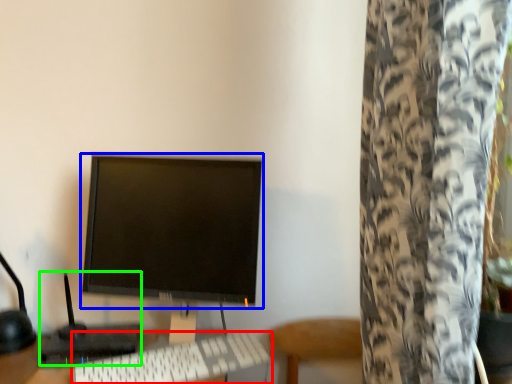
Question: Which object is the farthest from computer keyboard (highlighted by a red box)? Choose among these: computer monitor (highlighted by a blue box) or computer (highlighted by a green box).

Choices:
 (A) computer monitor
 (B) computer

Answer: (A)